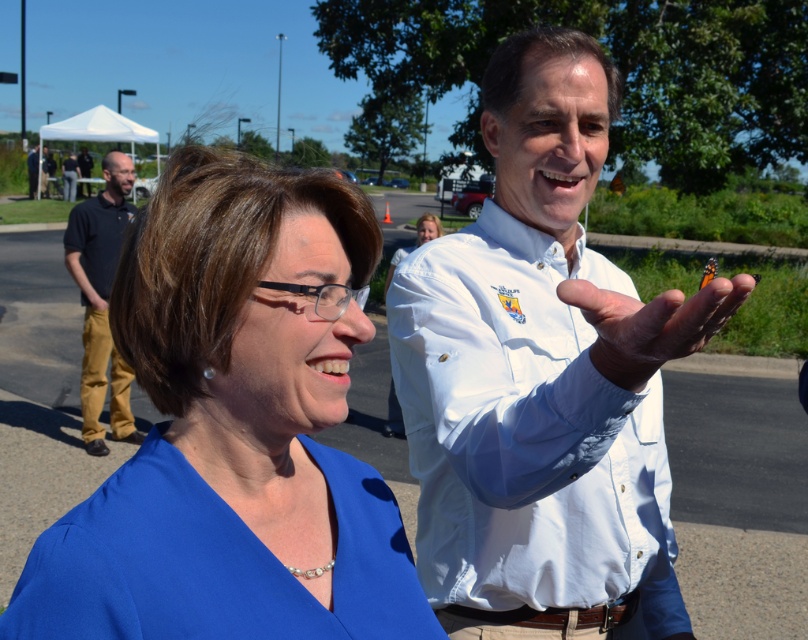
Question: Which point appears closest to the camera in this image?

Choices:
 (A) (179, 316)
 (B) (466, 440)
 (C) (680, 330)

Answer: (C)

Question: Can you confirm if blue fabric dress at center is positioned below smooth white hand at center?

Choices:
 (A) yes
 (B) no

Answer: (A)

Question: Is the position of dark blue shirt at left more distant than that of smooth white hand at center?

Choices:
 (A) yes
 (B) no

Answer: (A)

Question: Which object is the closest to the white cotton shirt at center?

Choices:
 (A) dark blue shirt at left
 (B) blue fabric dress at center
 (C) smooth white hand at center

Answer: (C)

Question: Is blue fabric dress at center positioned before dark blue shirt at left?

Choices:
 (A) no
 (B) yes

Answer: (B)

Question: Which is farther from the smooth white hand at center?

Choices:
 (A) dark blue shirt at left
 (B) blue fabric dress at center

Answer: (A)